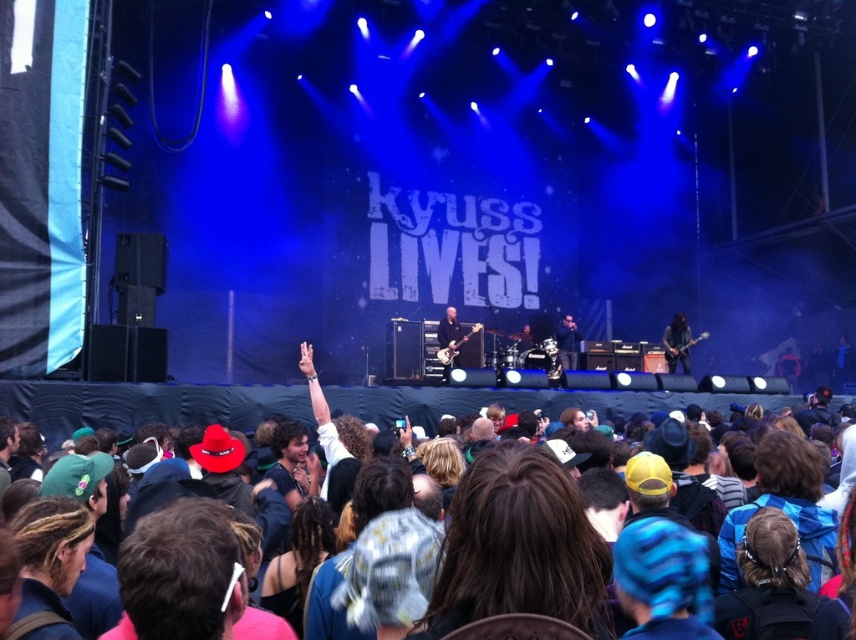
Question: Can you confirm if black matte guitar at center is bigger than matte black guitar at center?

Choices:
 (A) no
 (B) yes

Answer: (A)

Question: Does black matte guitar at center appear over matte black guitar at center?

Choices:
 (A) no
 (B) yes

Answer: (A)

Question: Which point is farther to the camera?

Choices:
 (A) black leather jacket at center
 (B) matte black guitar at center
 (C) black matte guitar at center

Answer: (A)

Question: Does matte black guitar at center come in front of black leather jacket at center?

Choices:
 (A) no
 (B) yes

Answer: (B)

Question: Which object is the closest to the black matte guitar at center?

Choices:
 (A) matte black guitar at center
 (B) black leather jacket at center

Answer: (B)

Question: Which point is farther to the camera?

Choices:
 (A) black matte guitar at center
 (B) matte black guitar at center

Answer: (A)